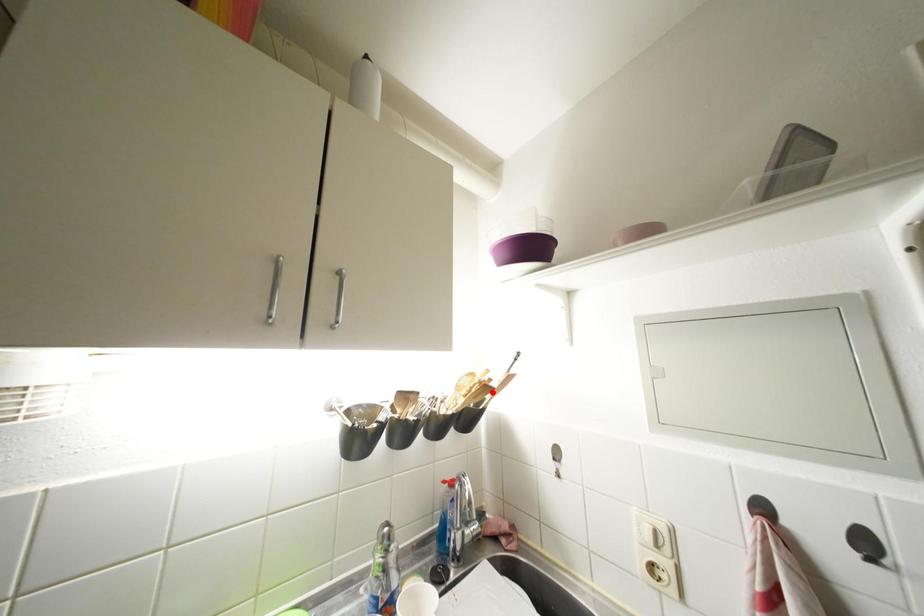
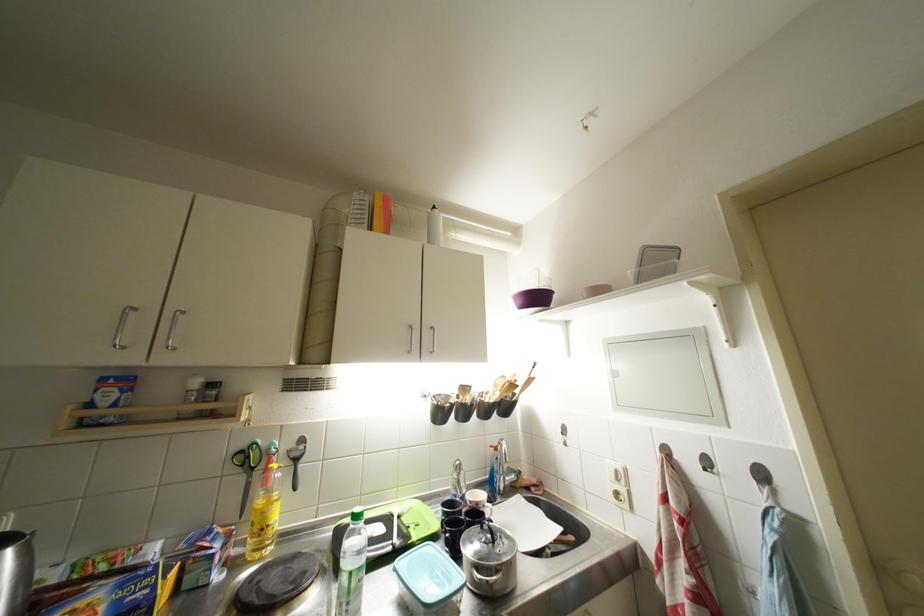
Find the pixel in the second image that matches the highlighted location in the first image.

(519, 390)